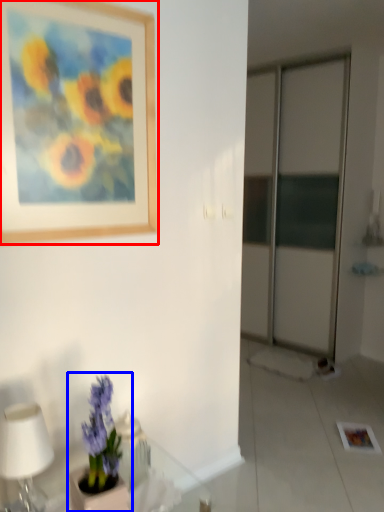
Question: Which point is further to the camera, picture frame (highlighted by a red box) or houseplant (highlighted by a blue box)?

Choices:
 (A) picture frame
 (B) houseplant

Answer: (A)